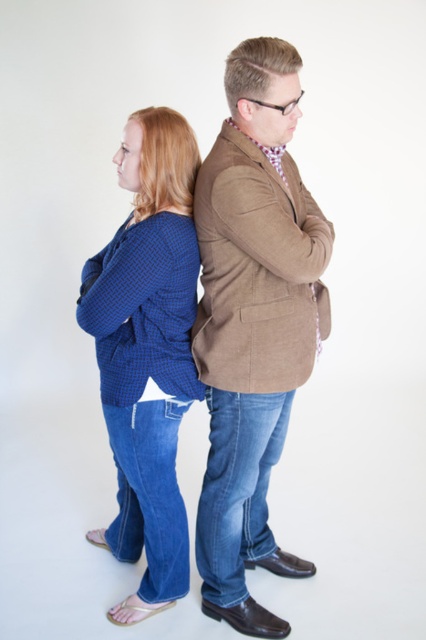
Question: Which object is farther from the camera taking this photo?

Choices:
 (A) matte brown blazer at center
 (B) blue checkered sweater at center

Answer: (B)

Question: Observing the image, what is the correct spatial positioning of blue checkered sweater at center in reference to matte brown blazer at center?

Choices:
 (A) below
 (B) above

Answer: (A)

Question: Which point is closer to the camera?

Choices:
 (A) blue checkered shirt at center
 (B) matte brown blazer at center

Answer: (A)

Question: Does blue checkered shirt at center have a smaller size compared to matte brown blazer at center?

Choices:
 (A) no
 (B) yes

Answer: (A)

Question: Which of the following is the farthest from the observer?

Choices:
 (A) (147, 280)
 (B) (252, 145)

Answer: (A)

Question: Is blue checkered sweater at center above matte brown blazer at center?

Choices:
 (A) yes
 (B) no

Answer: (B)